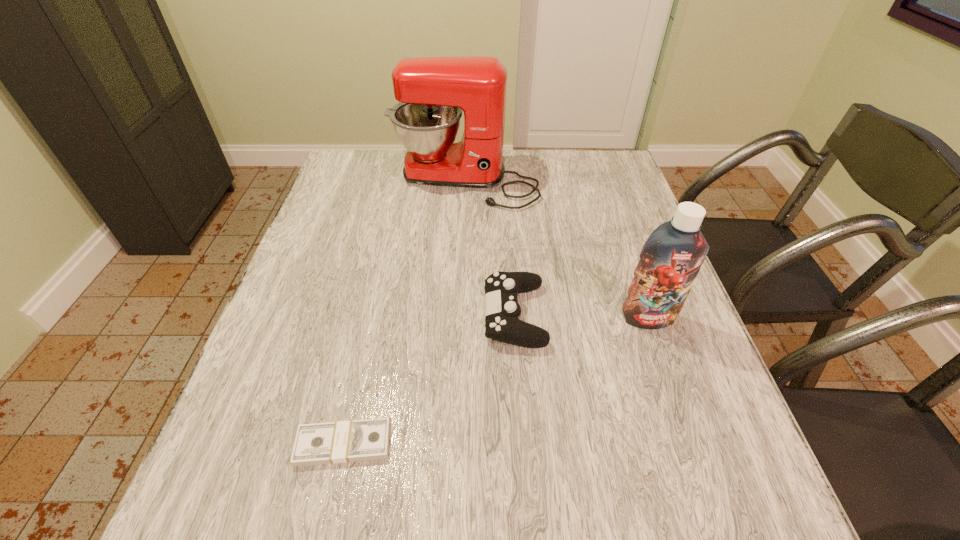
Locate an element on the screen. The width and height of the screenshot is (960, 540). vacant point located on the surface of the control is located at coordinates (321, 315).

Where is `free point located 0.120m on the back of the nearest object`? This screenshot has width=960, height=540. free point located 0.120m on the back of the nearest object is located at coordinates (361, 366).

Image resolution: width=960 pixels, height=540 pixels. Find the location of `object positioned at the far edge`. object positioned at the far edge is located at coordinates click(x=432, y=92).

You are a GUI agent. You are given a task and a screenshot of the screen. Output one action in this format:
    pyautogui.click(x=<x>, y=<y>)
    Task: Click on the object positioned at the left edge
    The image size is (960, 540).
    Given the screenshot: What is the action you would take?
    pyautogui.click(x=357, y=440)

Identify the location of object situated at the right edge. The width and height of the screenshot is (960, 540). (671, 258).

Where is `free space at the far edge of the desktop`? This screenshot has width=960, height=540. free space at the far edge of the desktop is located at coordinates (535, 171).

Where is `vacant space at the near edge of the desktop`? vacant space at the near edge of the desktop is located at coordinates (399, 494).

Find the location of a particular element. The image size is (960, 540). free spot at the left edge of the desktop is located at coordinates (266, 416).

Where is `vacant space at the right edge of the desktop`? vacant space at the right edge of the desktop is located at coordinates (666, 357).

You are a GUI agent. You are given a task and a screenshot of the screen. Output one action in this format:
    pyautogui.click(x=<x>, y=<y>)
    Task: Click on the free spot at the near left corner of the desktop
    Image resolution: width=960 pixels, height=540 pixels.
    Given the screenshot: What is the action you would take?
    pyautogui.click(x=282, y=482)